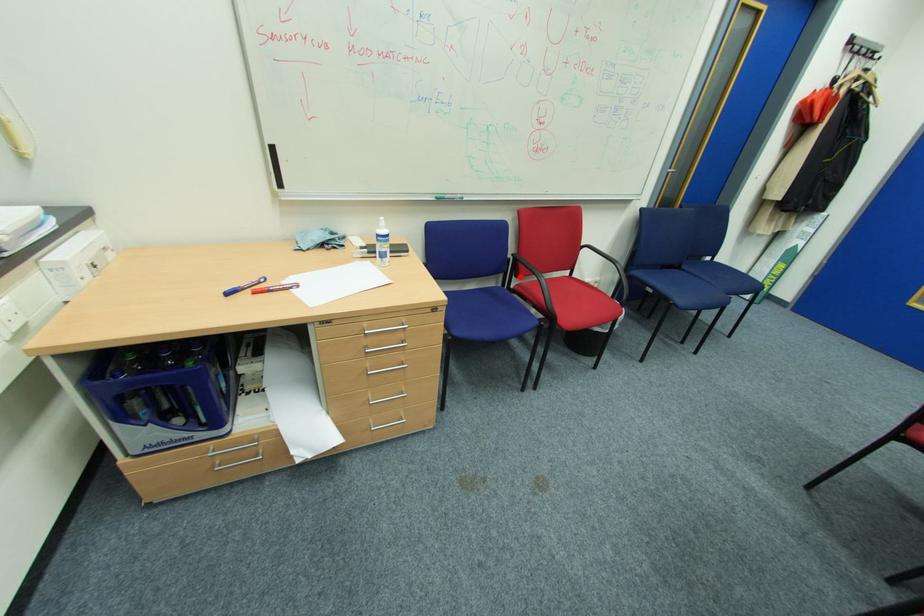
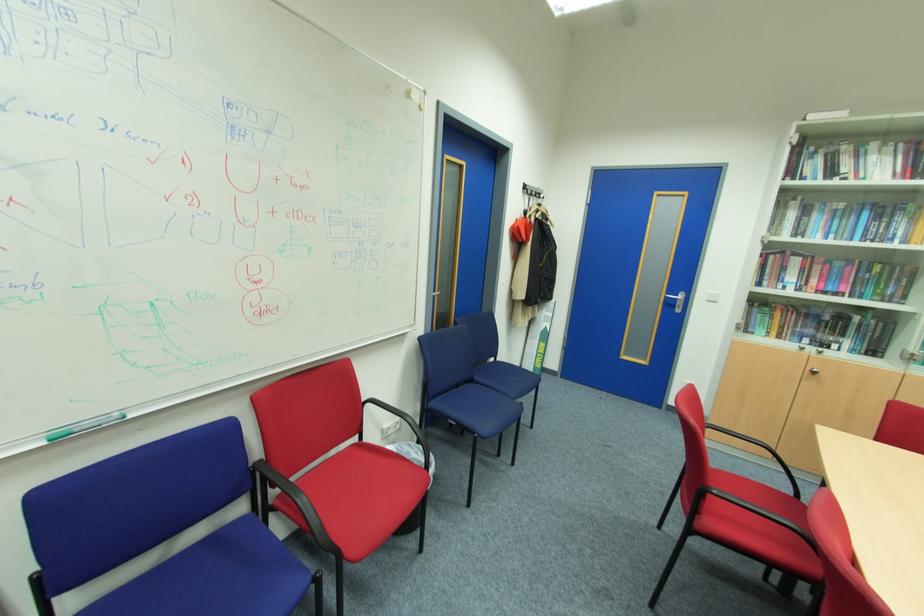
Question: I am providing you with two images of the same scene from different viewpoints. A red point is shown in image1. For the corresponding object point in image2, is it positioned nearer or farther from the camera?

Choices:
 (A) Nearer
 (B) Farther

Answer: (B)